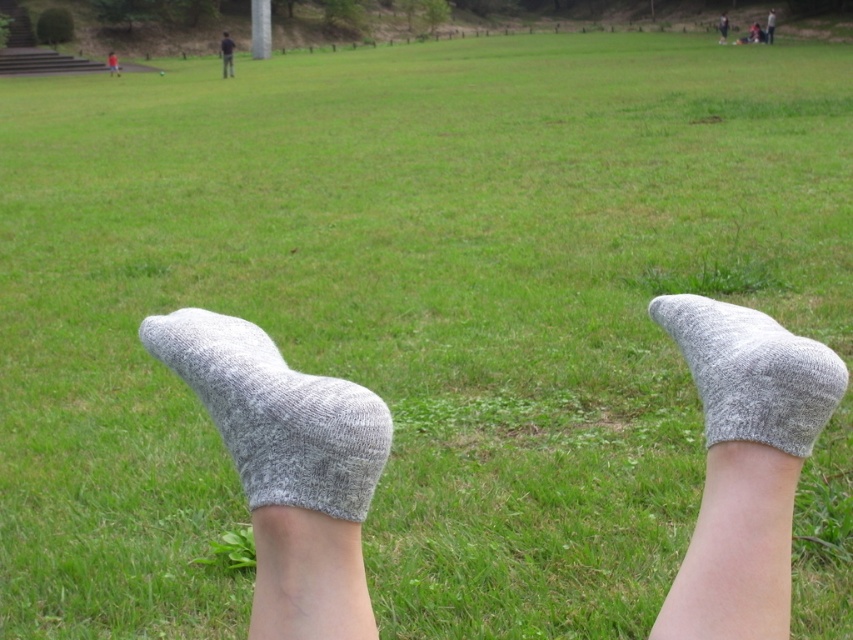
Is point (318, 486) closer to viewer compared to point (775, 20)?

Yes, point (318, 486) is in front of point (775, 20).

This screenshot has height=640, width=853. In order to click on gray knitted sock at lower center in this screenshot , I will do `click(276, 413)`.

Identify the location of gray knitted sock at lower center. (276, 413).

Can you confirm if gray knitted sock at lower right is bigger than gray knitted socks at lower center?

No.

What do you see at coordinates (752, 372) in the screenshot? I see `gray knitted sock at lower right` at bounding box center [752, 372].

Where is `gray knitted sock at lower right`? Image resolution: width=853 pixels, height=640 pixels. gray knitted sock at lower right is located at coordinates (752, 372).

Can you confirm if gray knitted sock at lower right is smaller than dark blue shirt at center?

Indeed, gray knitted sock at lower right has a smaller size compared to dark blue shirt at center.

Between gray knitted sock at lower right and dark blue shirt at center, which one appears on the left side from the viewer's perspective?

dark blue shirt at center is more to the left.

What do you see at coordinates (752, 372) in the screenshot? The width and height of the screenshot is (853, 640). I see `gray knitted sock at lower right` at bounding box center [752, 372].

At what (x,y) coordinates should I click in order to perform the action: click on gray knitted sock at lower right. Please return your answer as a coordinate pair (x, y). The image size is (853, 640). Looking at the image, I should click on (752, 372).